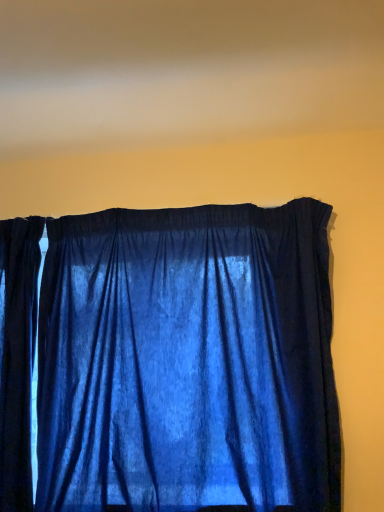
Question: From the image's perspective, is blue velvet curtain at upper center below velvet blue curtain at center?

Choices:
 (A) yes
 (B) no

Answer: (B)

Question: Considering the relative sizes of blue velvet curtain at upper center and velvet blue curtain at center in the image provided, is blue velvet curtain at upper center smaller than velvet blue curtain at center?

Choices:
 (A) yes
 (B) no

Answer: (A)

Question: Does blue velvet curtain at upper center come in front of velvet blue curtain at center?

Choices:
 (A) yes
 (B) no

Answer: (A)

Question: Does blue velvet curtain at upper center have a greater height compared to velvet blue curtain at center?

Choices:
 (A) yes
 (B) no

Answer: (B)

Question: From a real-world perspective, is blue velvet curtain at upper center located higher than velvet blue curtain at center?

Choices:
 (A) no
 (B) yes

Answer: (B)

Question: Is blue velvet curtain at upper center thinner than velvet blue curtain at center?

Choices:
 (A) no
 (B) yes

Answer: (A)

Question: From the image's perspective, does velvet blue curtain at center appear higher than blue velvet curtain at upper center?

Choices:
 (A) no
 (B) yes

Answer: (A)

Question: Is the position of velvet blue curtain at center less distant than that of blue velvet curtain at upper center?

Choices:
 (A) no
 (B) yes

Answer: (A)

Question: Is velvet blue curtain at center facing away from blue velvet curtain at upper center?

Choices:
 (A) yes
 (B) no

Answer: (B)

Question: Is velvet blue curtain at center at the left side of blue velvet curtain at upper center?

Choices:
 (A) no
 (B) yes

Answer: (B)

Question: Is velvet blue curtain at center surrounding blue velvet curtain at upper center?

Choices:
 (A) yes
 (B) no

Answer: (B)

Question: From a real-world perspective, is velvet blue curtain at center positioned over blue velvet curtain at upper center based on gravity?

Choices:
 (A) yes
 (B) no

Answer: (B)

Question: From a real-world perspective, relative to velvet blue curtain at center, is blue velvet curtain at upper center vertically above or below?

Choices:
 (A) below
 (B) above

Answer: (B)